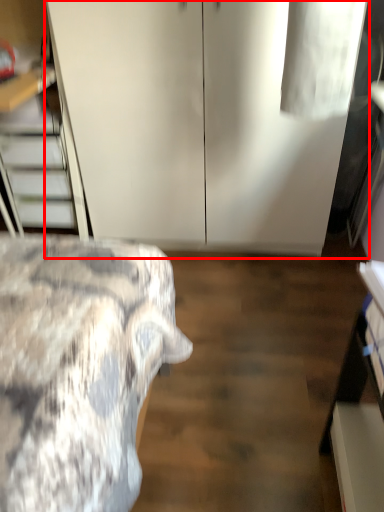
Question: From the image, what is the correct spatial relationship of dresser (annotated by the red box) in relation to stairwell?

Choices:
 (A) right
 (B) left

Answer: (A)